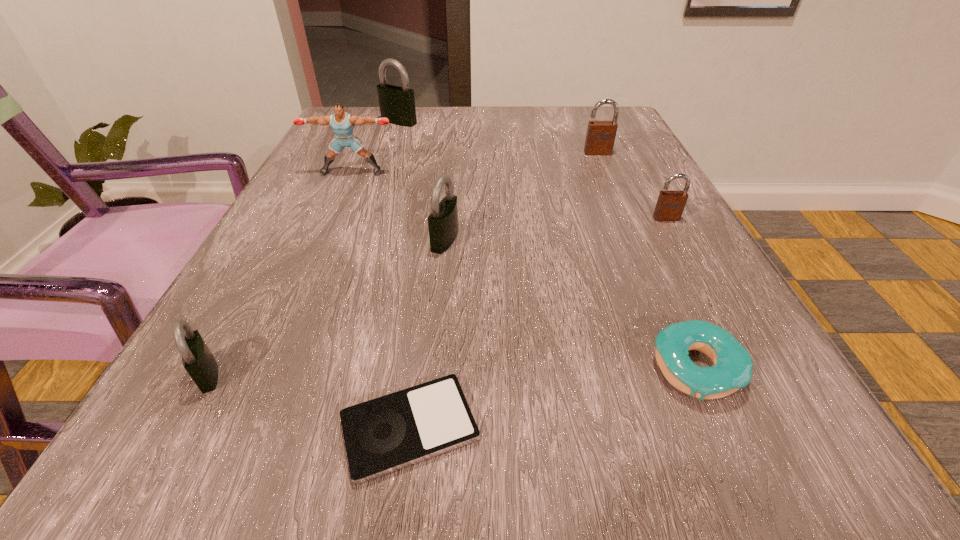
You are a GUI agent. You are given a task and a screenshot of the screen. Output one action in this format:
    pyautogui.click(x=<x>, y=<y>)
    Task: Click on the vacant space that satisfies the following two spatial constraints: 1. on the front-facing side of the second farthest black padlock; 2. on the left side of the puncher
    This screenshot has width=960, height=540.
    Given the screenshot: What is the action you would take?
    pyautogui.click(x=322, y=240)

In order to click on vacant space that satisfies the following two spatial constraints: 1. on the front-facing side of the puncher; 2. on the left side of the doughnut in this screenshot , I will do `click(265, 369)`.

You are a GUI agent. You are given a task and a screenshot of the screen. Output one action in this format:
    pyautogui.click(x=<x>, y=<y>)
    Task: Click on the free location that satisfies the following two spatial constraints: 1. on the front side of the shortest object; 2. on the right side of the smallest black padlock
    This screenshot has width=960, height=540.
    Given the screenshot: What is the action you would take?
    pyautogui.click(x=179, y=428)